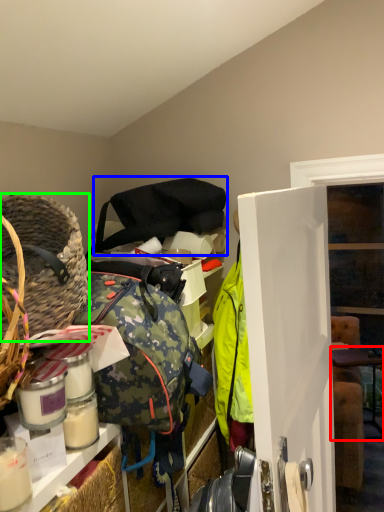
Question: Considering the real-world distances, which object is farthest from table (highlighted by a red box)? shoulder bag (highlighted by a blue box) or basket (highlighted by a green box)?

Choices:
 (A) shoulder bag
 (B) basket

Answer: (B)